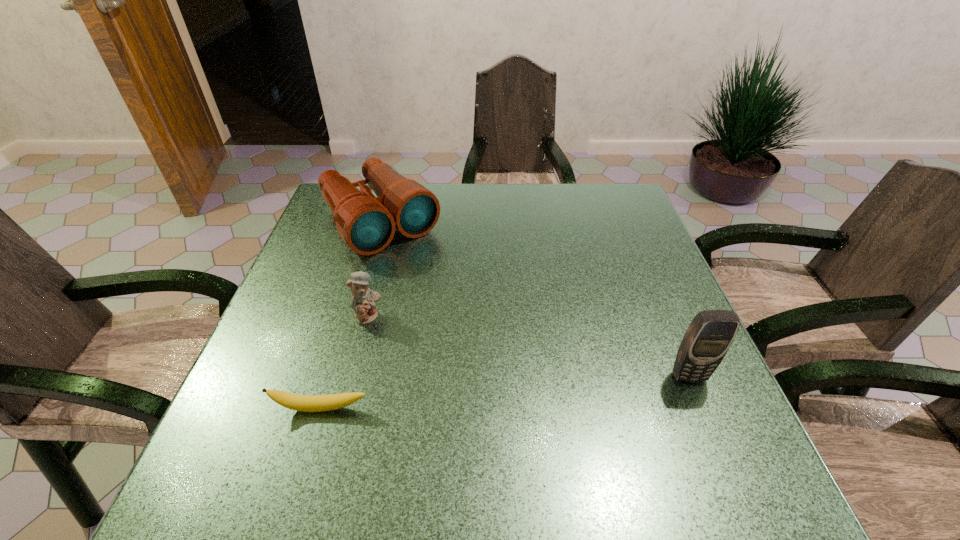
Find the location of a particular element. This screenshot has height=540, width=960. vacant space on the desktop that is between the shortest object and the tallest object and is positioned on the front-facing side of the teddy bear is located at coordinates (470, 395).

The height and width of the screenshot is (540, 960). In order to click on free spot on the desktop that is between the nearest object and the tallest object and is positioned through the lenses of the binoculars in this screenshot , I will do `click(529, 390)`.